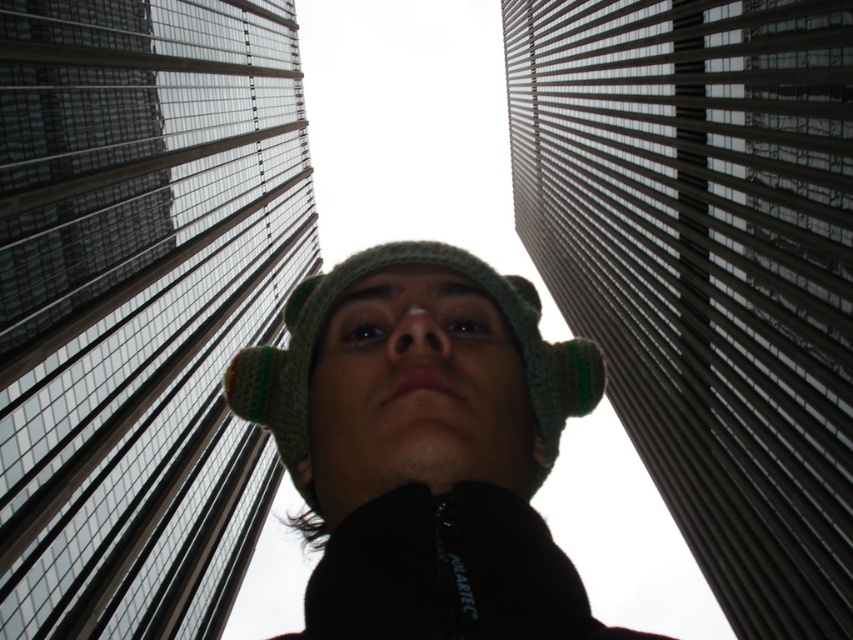
You are standing in the middle of the street looking at the two glassy skyscrapers. Which one is closer to you, the glassy steel skyscraper at center or the glassy reflective skyscraper at center?

The glassy steel skyscraper at center is closer to you because it is in front of the glassy reflective skyscraper at center.

You are standing in the city and see the point marked at coordinates (138, 301). Based on the scene description, where is this point located?

The point at (138, 301) is located on the glassy steel skyscraper at center.

You are standing in the scene and want to reach the two points marked in the image. Which point, point (763, 236) or point (352, 288), is closer to you?

Point (763, 236) is closer to you because it is further to the viewer than point (352, 288).